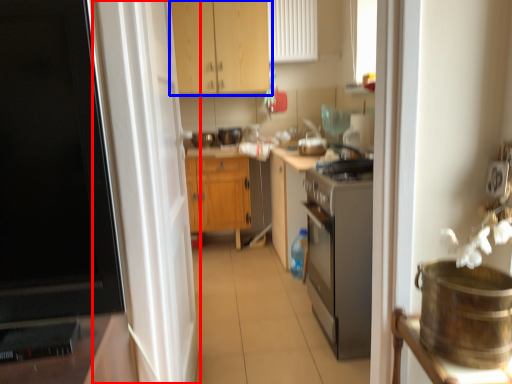
Question: Which of the following is the farthest to the observer, screen door (highlighted by a red box) or cabinetry (highlighted by a blue box)?

Choices:
 (A) screen door
 (B) cabinetry

Answer: (B)